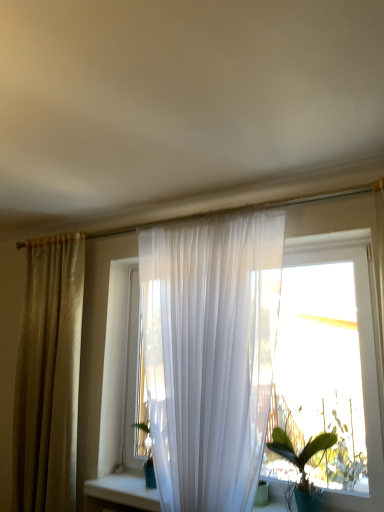
The width and height of the screenshot is (384, 512). What do you see at coordinates (97, 335) in the screenshot?
I see `translucent white curtain at center` at bounding box center [97, 335].

At what (x,y) coordinates should I click in order to perform the action: click on matte beige curtain at left. Please return your answer as a coordinate pair (x, y). Image resolution: width=384 pixels, height=512 pixels. Looking at the image, I should click on (48, 376).

Is matte beige curtain at left surrounded by green glossy leafy plant at lower right?

No, green glossy leafy plant at lower right does not contain matte beige curtain at left.

Is point (292, 451) less distant than point (27, 273)?

Yes, point (292, 451) is closer to viewer.

From the picture: From the image's perspective, is green glossy leafy plant at lower right located above matte beige curtain at left?

No, from the image's perspective, green glossy leafy plant at lower right is not over matte beige curtain at left.

Which object is positioned more to the right, green glossy leafy plant at lower right or matte beige curtain at left?

green glossy leafy plant at lower right is more to the right.

Can you confirm if translucent white curtain at center is positioned to the right of matte beige curtain at left?

Yes.

Between point (316, 205) and point (63, 481), which one is positioned behind?

Positioned behind is point (63, 481).

Can you confirm if translucent white curtain at center is bigger than matte beige curtain at left?

Actually, translucent white curtain at center might be smaller than matte beige curtain at left.

From a real-world perspective, who is located higher, matte beige curtain at left or translucent white curtain at center?

From a 3D spatial view, translucent white curtain at center is above.

Which is in front, point (60, 450) or point (123, 237)?

The point (60, 450) is more forward.

Does matte beige curtain at left contain translucent white curtain at center?

No, translucent white curtain at center is not surrounded by matte beige curtain at left.

From the image's perspective, is matte beige curtain at left located above or below translucent white curtain at center?

Clearly, from the image's perspective, matte beige curtain at left is below translucent white curtain at center.

Is the position of translucent white curtain at center more distant than that of green glossy leafy plant at lower right?

No.

Identify the location of window above the green glossy leafy plant at lower right (from a real-world perspective). (97, 335).

Does translucent white curtain at center have a greater height compared to green glossy leafy plant at lower right?

Correct, translucent white curtain at center is much taller as green glossy leafy plant at lower right.

Looking at this image, from a real-world perspective, is green glossy leafy plant at lower right physically above translucent white curtain at center?

No, from a real-world perspective, green glossy leafy plant at lower right is not on top of translucent white curtain at center.

Is green glossy leafy plant at lower right looking in the opposite direction of translucent white curtain at center?

Yes, translucent white curtain at center is at the back of green glossy leafy plant at lower right.

Does green glossy leafy plant at lower right have a smaller size compared to translucent white curtain at center?

Correct, green glossy leafy plant at lower right occupies less space than translucent white curtain at center.

Is green glossy leafy plant at lower right outside of translucent white curtain at center?

Absolutely, green glossy leafy plant at lower right is external to translucent white curtain at center.

From the image's perspective, is matte beige curtain at left positioned above or below green glossy leafy plant at lower right?

Based on their image positions, matte beige curtain at left is located above green glossy leafy plant at lower right.

Considering the sizes of objects matte beige curtain at left and green glossy leafy plant at lower right in the image provided, who is thinner, matte beige curtain at left or green glossy leafy plant at lower right?

With smaller width is green glossy leafy plant at lower right.

Considering the relative sizes of matte beige curtain at left and green glossy leafy plant at lower right in the image provided, is matte beige curtain at left bigger than green glossy leafy plant at lower right?

Indeed, matte beige curtain at left has a larger size compared to green glossy leafy plant at lower right.

At what (x,y) coordinates should I click in order to perform the action: click on houseplant located below the matte beige curtain at left (from the image's perspective). Please return your answer as a coordinate pair (x, y). Image resolution: width=384 pixels, height=512 pixels. Looking at the image, I should click on (301, 465).

This screenshot has width=384, height=512. In order to click on curtain that is on the left side of translucent white curtain at center in this screenshot , I will do `click(48, 376)`.

Based on their spatial positions, is green glossy leafy plant at lower right or matte beige curtain at left further from translucent white curtain at center?

green glossy leafy plant at lower right is further to translucent white curtain at center.

Estimate the real-world distances between objects in this image. Which object is closer to green glossy leafy plant at lower right, matte beige curtain at left or translucent white curtain at center?

translucent white curtain at center is closer to green glossy leafy plant at lower right.

Which object lies nearer to the anchor point matte beige curtain at left, green glossy leafy plant at lower right or translucent white curtain at center?

translucent white curtain at center is positioned closer to the anchor matte beige curtain at left.

Looking at the image, which one is located further to green glossy leafy plant at lower right, translucent white curtain at center or matte beige curtain at left?

Among the two, matte beige curtain at left is located further to green glossy leafy plant at lower right.

Consider the image. Estimate the real-world distances between objects in this image. Which object is closer to matte beige curtain at left, translucent white curtain at center or green glossy leafy plant at lower right?

translucent white curtain at center is closer to matte beige curtain at left.

Which object lies nearer to the anchor point translucent white curtain at center, matte beige curtain at left or green glossy leafy plant at lower right?

Based on the image, matte beige curtain at left appears to be nearer to translucent white curtain at center.

At what (x,y) coordinates should I click in order to perform the action: click on window between matte beige curtain at left and green glossy leafy plant at lower right. Please return your answer as a coordinate pair (x, y). Looking at the image, I should click on (97, 335).